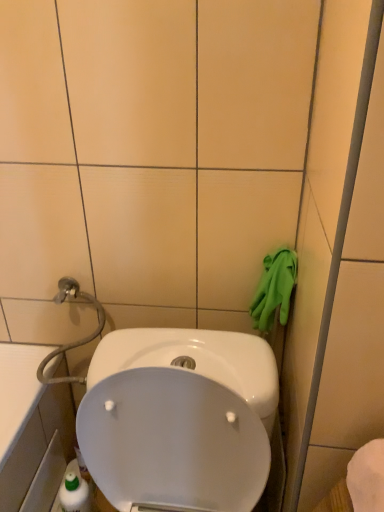
Question: Is green rubber gloves at right oriented away from green rubber glove at right?

Choices:
 (A) yes
 (B) no

Answer: (B)

Question: Does green rubber gloves at right have a lesser height compared to green rubber glove at right?

Choices:
 (A) yes
 (B) no

Answer: (A)

Question: Is green rubber gloves at right to the right of green rubber glove at right from the viewer's perspective?

Choices:
 (A) yes
 (B) no

Answer: (B)

Question: Can you confirm if green rubber gloves at right is thinner than green rubber glove at right?

Choices:
 (A) no
 (B) yes

Answer: (A)

Question: Considering the relative positions of green rubber gloves at right and green rubber glove at right in the image provided, is green rubber gloves at right behind green rubber glove at right?

Choices:
 (A) no
 (B) yes

Answer: (B)

Question: Is green rubber gloves at right outside of green rubber glove at right?

Choices:
 (A) yes
 (B) no

Answer: (A)

Question: Is green rubber glove at right touching green rubber gloves at right?

Choices:
 (A) no
 (B) yes

Answer: (A)

Question: Is green rubber glove at right in front of green rubber gloves at right?

Choices:
 (A) yes
 (B) no

Answer: (A)

Question: Are green rubber glove at right and green rubber gloves at right located far from each other?

Choices:
 (A) no
 (B) yes

Answer: (A)

Question: Is green rubber glove at right at the left side of green rubber gloves at right?

Choices:
 (A) no
 (B) yes

Answer: (A)

Question: Is green rubber glove at right bigger than green rubber gloves at right?

Choices:
 (A) yes
 (B) no

Answer: (A)

Question: Considering the relative sizes of green rubber glove at right and green rubber gloves at right in the image provided, is green rubber glove at right taller than green rubber gloves at right?

Choices:
 (A) no
 (B) yes

Answer: (B)

Question: Would you say green rubber gloves at right is to the left or to the right of green rubber glove at right in the picture?

Choices:
 (A) left
 (B) right

Answer: (A)